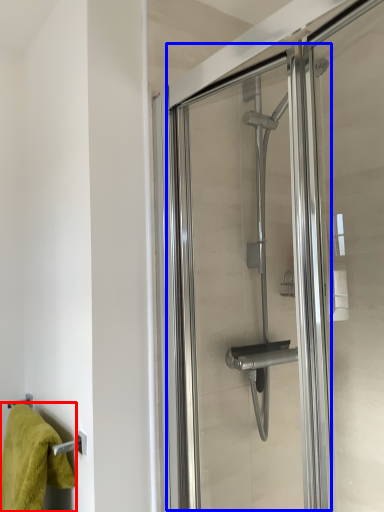
Question: Which point is closer to the camera, towel (highlighted by a red box) or screen door (highlighted by a blue box)?

Choices:
 (A) towel
 (B) screen door

Answer: (B)